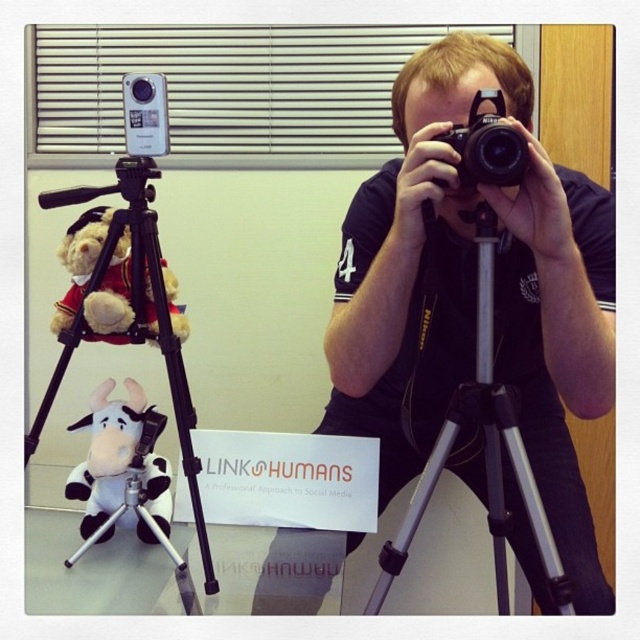
Question: Does silver metallic tripod at center have a greater width compared to velvet teddy bear at left?

Choices:
 (A) no
 (B) yes

Answer: (B)

Question: Among these objects, which one is nearest to the camera?

Choices:
 (A) silver metallic tripod at lower left
 (B) black plastic camera at center
 (C) velvet teddy bear at left

Answer: (B)

Question: Estimate the real-world distances between objects in this image. Which object is farther from the white plush cow at center?

Choices:
 (A) black plastic camera at center
 (B) velvet teddy bear at left

Answer: (A)

Question: Can you confirm if silver metallic tripod at center is thinner than silver metallic tripod at lower left?

Choices:
 (A) yes
 (B) no

Answer: (A)

Question: Is silver metallic tripod at center bigger than white plush cow at center?

Choices:
 (A) no
 (B) yes

Answer: (B)

Question: Which point is farther to the camera?

Choices:
 (A) white plush cow at center
 (B) velvet teddy bear at left
 (C) silver metallic tripod at lower left
 (D) silver metallic tripod at center

Answer: (A)